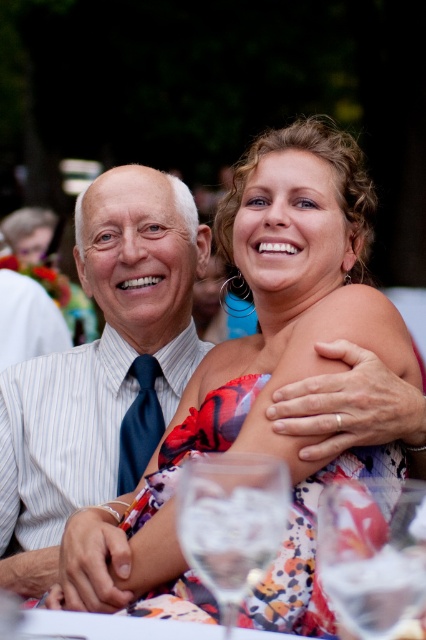
You are a photographer at this event and need to position a spotlight on the floral dress at center and the white striped shirt at left. According to the scene, which object should be placed higher when setting up the lighting to match their positions?

The floral dress at center should be placed higher than the white striped shirt at left because it is located above it in the image.

You are a photographer at this event and need to ensure both the floral dress at center and the white striped shirt at left are visible in the photo. Given their sizes, which one might require more space in the frame?

The floral dress at center is larger in size than the white striped shirt at left, so it would require more space in the frame to ensure it is fully visible.

Where is the white striped shirt at left located in the image?

The white striped shirt at left is located at point [103,368].